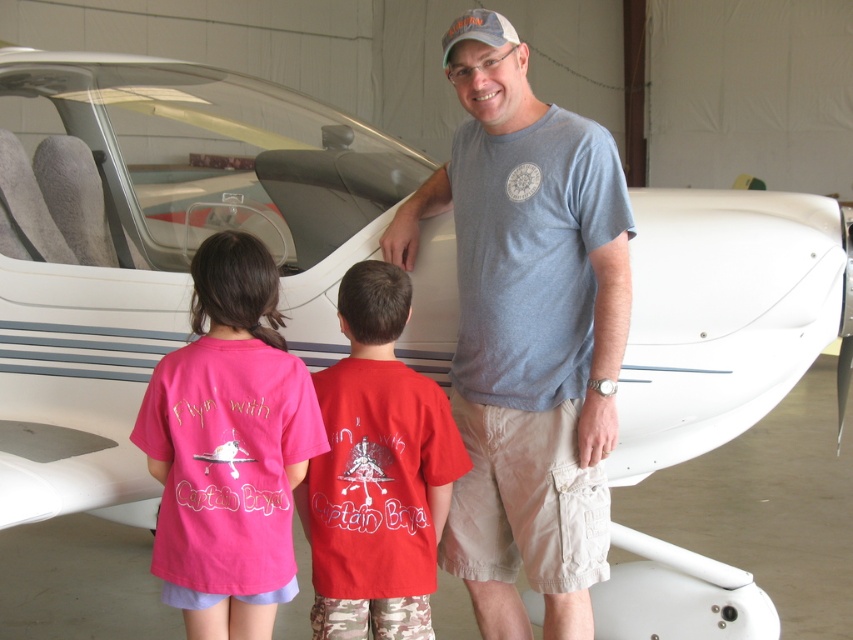
Question: Can you confirm if gray cotton t-shirt at center is positioned above pink fabric shirt at center?

Choices:
 (A) no
 (B) yes

Answer: (B)

Question: Can you confirm if pink fabric shirt at center is wider than red cotton shirt at center?

Choices:
 (A) yes
 (B) no

Answer: (A)

Question: Among these objects, which one is nearest to the camera?

Choices:
 (A) pink fabric shirt at center
 (B) gray cotton t-shirt at center
 (C) red cotton shirt at center

Answer: (A)

Question: Is gray cotton t-shirt at center further to the viewer compared to red cotton shirt at center?

Choices:
 (A) yes
 (B) no

Answer: (A)

Question: Among these points, which one is nearest to the camera?

Choices:
 (A) (213, 582)
 (B) (399, 296)

Answer: (A)

Question: Which object is the closest to the red cotton shirt at center?

Choices:
 (A) gray cotton t-shirt at center
 (B) pink fabric shirt at center

Answer: (B)